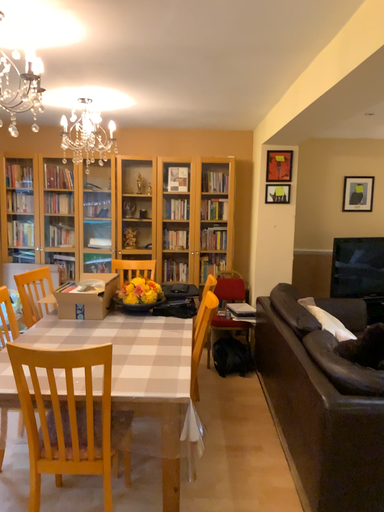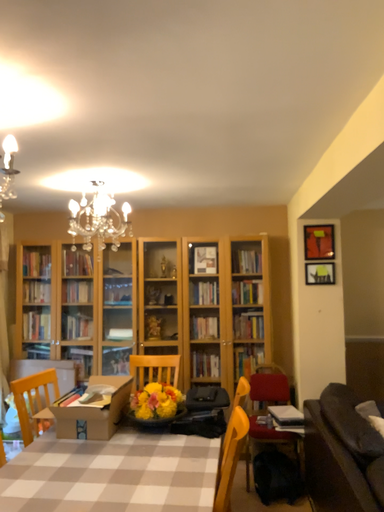
Question: Which way did the camera rotate in the video?

Choices:
 (A) rotated upward
 (B) rotated downward

Answer: (A)